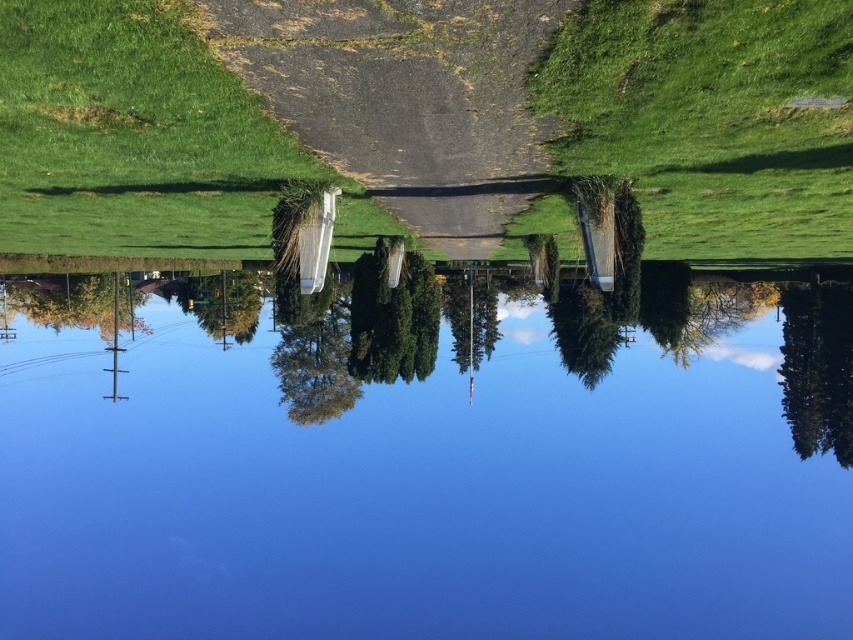
Question: Which object appears closest to the camera in this image?

Choices:
 (A) green grassy at upper right
 (B) green grass at upper left
 (C) blue glass lake at center
 (D) gravelly asphalt path at center

Answer: (A)

Question: Which point is closer to the camera taking this photo?

Choices:
 (A) pyautogui.click(x=51, y=221)
 (B) pyautogui.click(x=796, y=208)

Answer: (B)

Question: Can you confirm if blue glass lake at center is thinner than green grassy at upper right?

Choices:
 (A) no
 (B) yes

Answer: (A)

Question: Can you confirm if blue glass lake at center is positioned below green grassy at upper right?

Choices:
 (A) no
 (B) yes

Answer: (B)

Question: Is green grass at upper left behind gravelly asphalt path at center?

Choices:
 (A) no
 (B) yes

Answer: (A)

Question: Which point is closer to the camera taking this photo?

Choices:
 (A) (804, 19)
 (B) (126, 156)
 (C) (267, 36)
 (D) (665, 371)

Answer: (A)